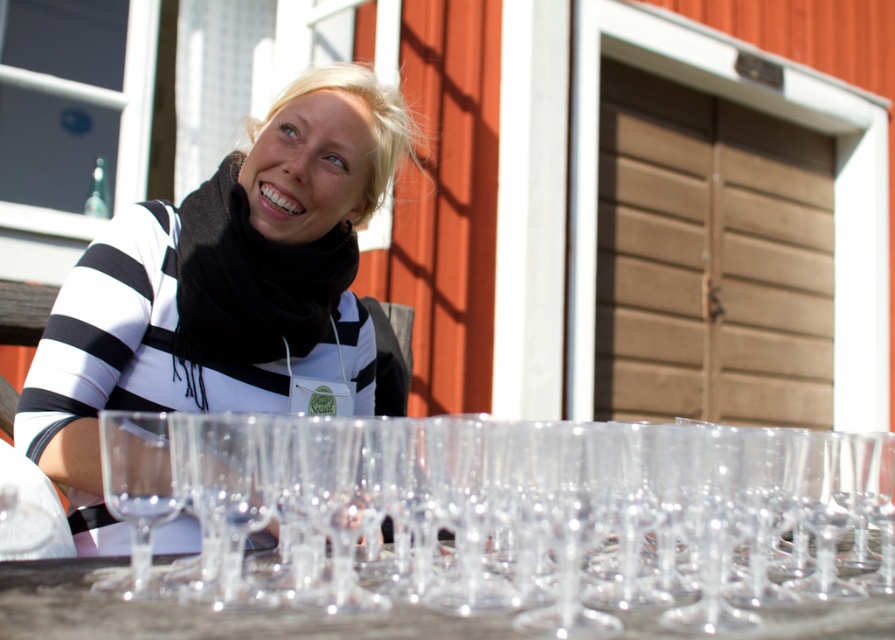
Between transparent glass wine glass at center and transparent glassware at lower center, which one appears on the right side from the viewer's perspective?

Positioned to the right is transparent glass wine glass at center.

What do you see at coordinates (559, 513) in the screenshot? This screenshot has height=640, width=895. I see `transparent glass wine glass at center` at bounding box center [559, 513].

This screenshot has height=640, width=895. I want to click on transparent glass wine glass at center, so click(559, 513).

Does black matte scarf at upper left have a greater width compared to transparent glassware at lower center?

No.

Is black matte scarf at upper left closer to the viewer compared to transparent glassware at lower center?

That is False.

At what (x,y) coordinates should I click in order to perform the action: click on black matte scarf at upper left. Please return your answer as a coordinate pair (x, y). Image resolution: width=895 pixels, height=640 pixels. Looking at the image, I should click on (220, 289).

Where is `transparent glass wine glass at center`? The width and height of the screenshot is (895, 640). transparent glass wine glass at center is located at coordinates (559, 513).

Is point (817, 541) positioned behind point (320, 202)?

No, it is in front of (320, 202).

Find the location of `transparent glass wine glass at center`. transparent glass wine glass at center is located at coordinates (559, 513).

Find the location of a particular element. The width and height of the screenshot is (895, 640). transparent glass wine glass at center is located at coordinates (559, 513).